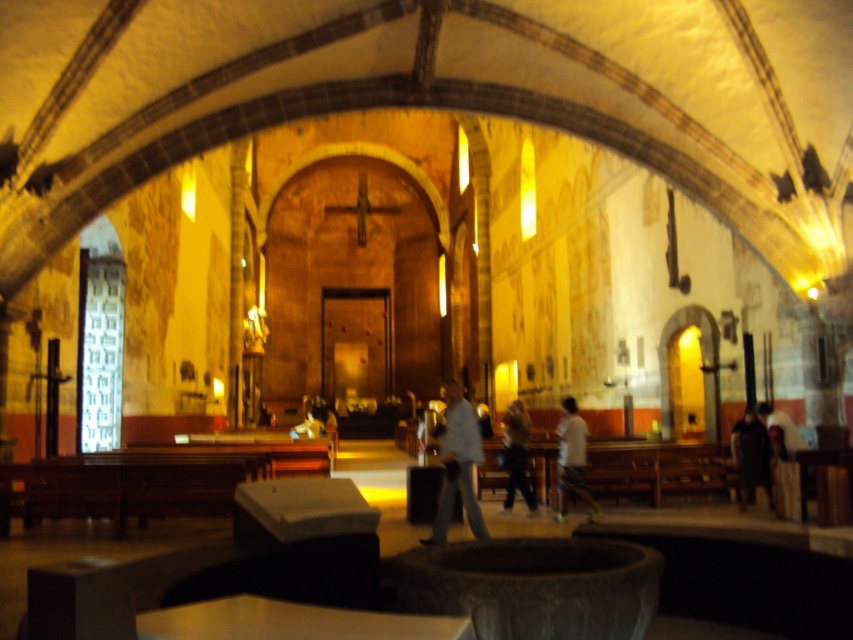
You are standing in the church and notice two items at the center area. Which item is positioned higher between the white cotton shirt at center and the light brown leather jacket at center?

The white cotton shirt at center is positioned higher than the light brown leather jacket at center.

You are a visitor in the church and you see the light gray fabric pants at center and the light brown leather jacket at center. Which one is closer to the floor?

The light gray fabric pants at center is positioned under the light brown leather jacket at center, so it is closer to the floor.